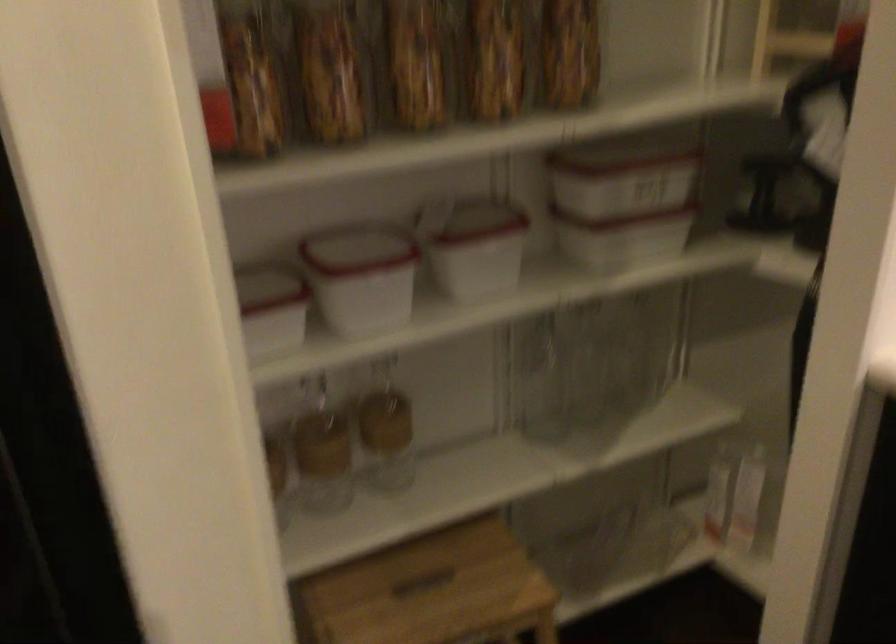
The image size is (896, 644). What do you see at coordinates (428, 565) in the screenshot?
I see `a stool handle cutout` at bounding box center [428, 565].